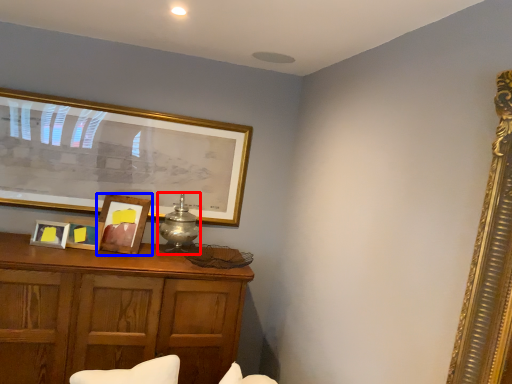
Question: Which of the following is the farthest to the observer, table lamp (highlighted by a red box) or picture frame (highlighted by a blue box)?

Choices:
 (A) table lamp
 (B) picture frame

Answer: (A)